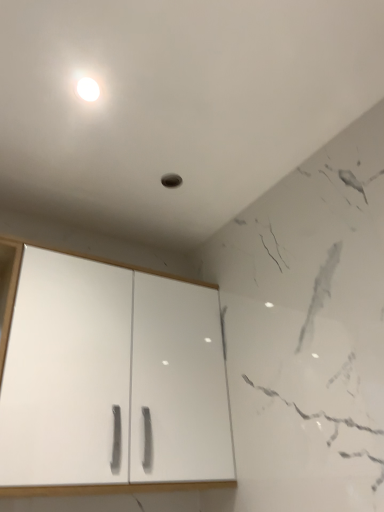
Question: Is white glossy light at upper center inside or outside of white matte cabinet at center?

Choices:
 (A) outside
 (B) inside

Answer: (A)

Question: From the image's perspective, is white glossy light at upper center positioned above or below white matte cabinet at center?

Choices:
 (A) below
 (B) above

Answer: (B)

Question: Considering the positions of white glossy light at upper center and white matte cabinet at center in the image, is white glossy light at upper center wider or thinner than white matte cabinet at center?

Choices:
 (A) thin
 (B) wide

Answer: (A)

Question: Considering the positions of white matte cabinet at center and white glossy light at upper center in the image, is white matte cabinet at center wider or thinner than white glossy light at upper center?

Choices:
 (A) wide
 (B) thin

Answer: (A)

Question: From the image's perspective, is white matte cabinet at center above or below white glossy light at upper center?

Choices:
 (A) below
 (B) above

Answer: (A)

Question: In terms of height, does white matte cabinet at center look taller or shorter compared to white glossy light at upper center?

Choices:
 (A) tall
 (B) short

Answer: (A)

Question: Is white matte cabinet at center in front of or behind white glossy light at upper center in the image?

Choices:
 (A) front
 (B) behind

Answer: (A)